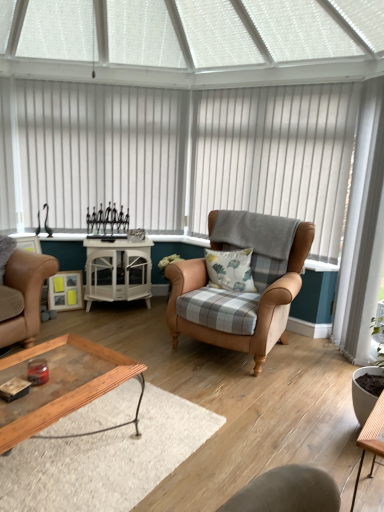
Identify the location of free spot above white vertical blinds at upper center, the first blind when ordered from left to right (from a real-world perspective). This screenshot has width=384, height=512. (105, 77).